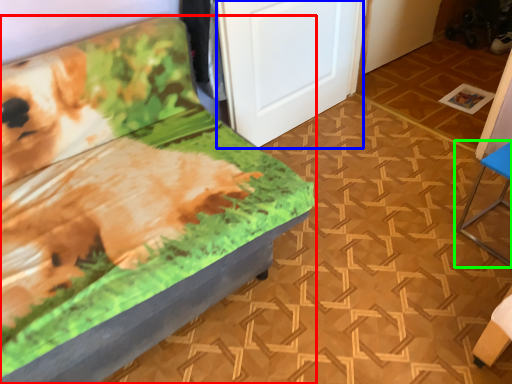
Question: Which object is the closest to the furniture (highlighted by a red box)? Choose among these: door (highlighted by a blue box) or furniture (highlighted by a green box).

Choices:
 (A) door
 (B) furniture

Answer: (A)